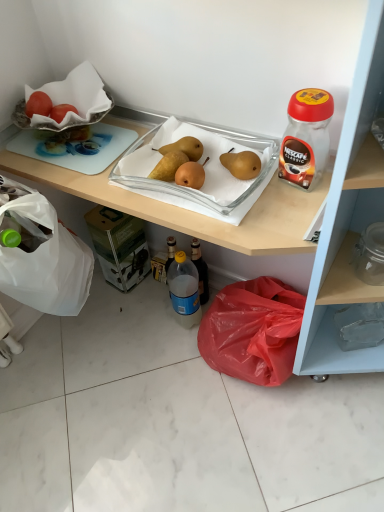
The width and height of the screenshot is (384, 512). What are the coordinates of `free space in front of smooth red tomato at upper left` in the screenshot? It's located at (75, 150).